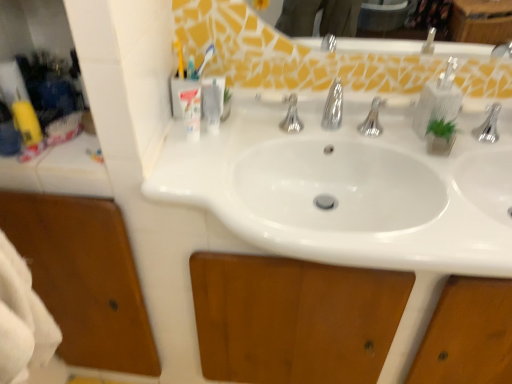
Find the location of `free space in front of translucent plastic toothbrush holder at upper left, the 1th toiletry viewed from the left`. free space in front of translucent plastic toothbrush holder at upper left, the 1th toiletry viewed from the left is located at coordinates (190, 179).